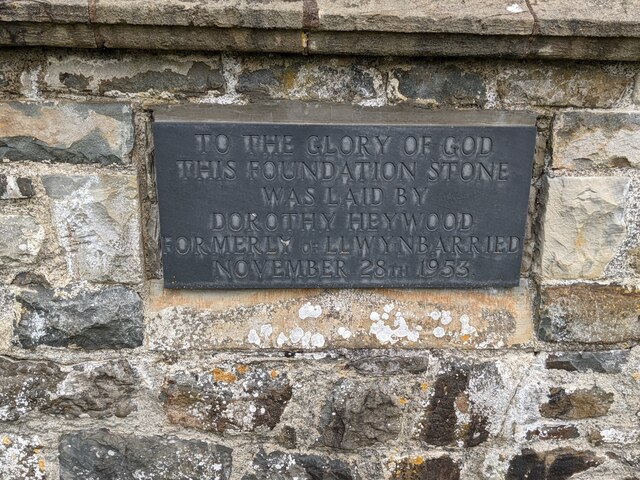
Image resolution: width=640 pixels, height=480 pixels. Find the location of `grout`. grout is located at coordinates (148, 419).